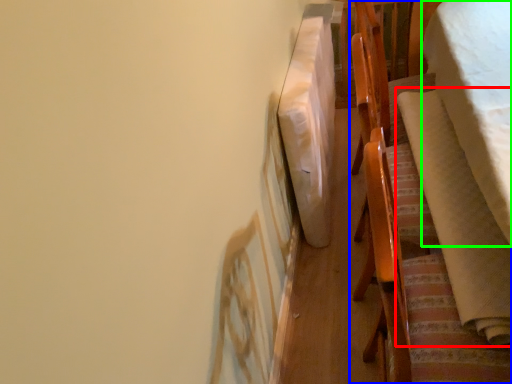
Question: Which object is positioned farthest from blanket (highlighted by a red box)? Select from furniture (highlighted by a blue box) and blanket (highlighted by a green box).

Choices:
 (A) furniture
 (B) blanket

Answer: (B)